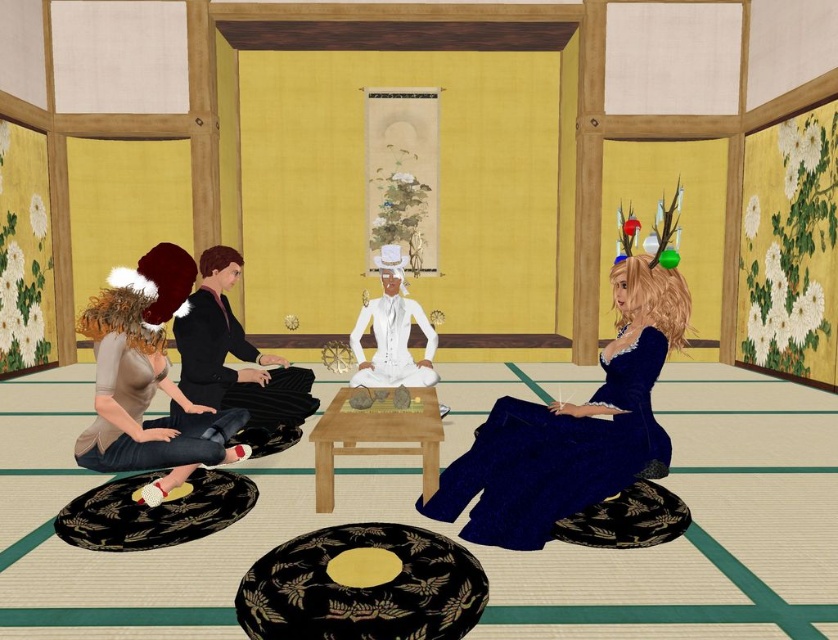
You are a guest entering the room and need to choose between the navy satin dress at lower right and the matte beige dress at lower left. Which dress is closer to the entrance?

The navy satin dress at lower right is positioned under the matte beige dress at lower left, meaning it is closer to the entrance.

You are standing in the traditional Japanese room and want to touch the two points on the wall. The first point is at coordinates point (147, 461) and the second is at point (114, 433). Which point will require you to reach further forward to touch?

The point at (114, 433) is further away from the viewer, so you will need to reach further forward to touch it compared to the point at (147, 461).

Which direction is the person with matte brown hair at left facing?

The person with matte brown hair at left is facing towards the center of the room.